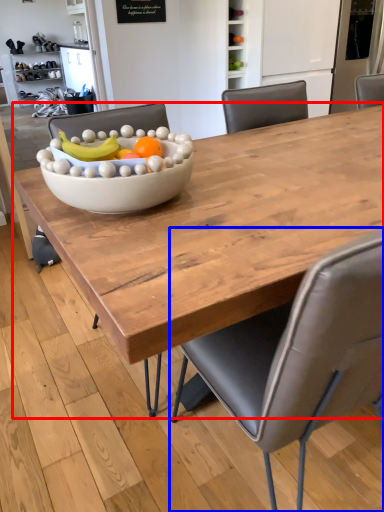
Question: Which object is further to the camera taking this photo, coffee table (highlighted by a red box) or chair (highlighted by a blue box)?

Choices:
 (A) coffee table
 (B) chair

Answer: (A)